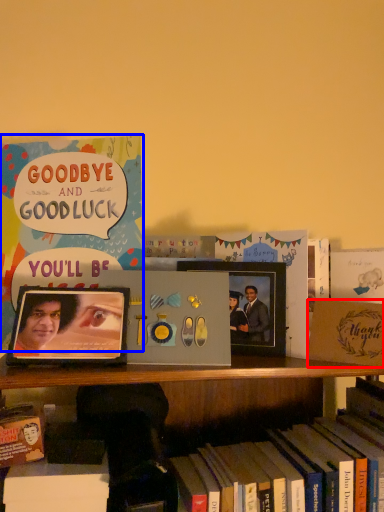
Question: Which point is further to the camera, paperback book (highlighted by a red box) or book (highlighted by a blue box)?

Choices:
 (A) paperback book
 (B) book

Answer: (B)